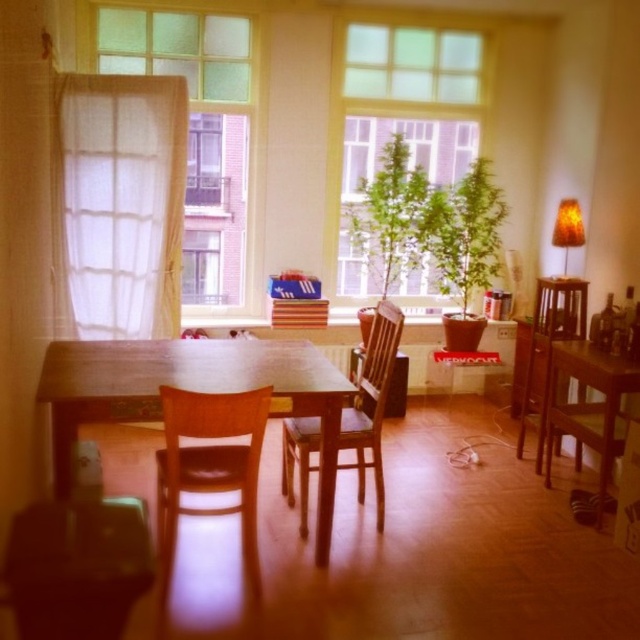
Question: Is wooden chair at center wider than wooden chair at right?

Choices:
 (A) no
 (B) yes

Answer: (B)

Question: Among these objects, which one is farthest from the camera?

Choices:
 (A) translucent glass window at upper left
 (B) clear glass window at upper center

Answer: (B)

Question: Where is green leafy plant at center located in relation to transparent glass window at center in the image?

Choices:
 (A) left
 (B) right

Answer: (B)

Question: Which object is farther from the camera taking this photo?

Choices:
 (A) green leafy plant at center
 (B) clear glass window at upper center
 (C) white sheer curtain at left

Answer: (A)

Question: Does clear glass window at upper center lie behind transparent glass window at center?

Choices:
 (A) no
 (B) yes

Answer: (A)

Question: Based on their relative distances, which object is nearer to the brown leather chair at center?

Choices:
 (A) translucent glass window at upper left
 (B) white sheer curtain at left

Answer: (B)